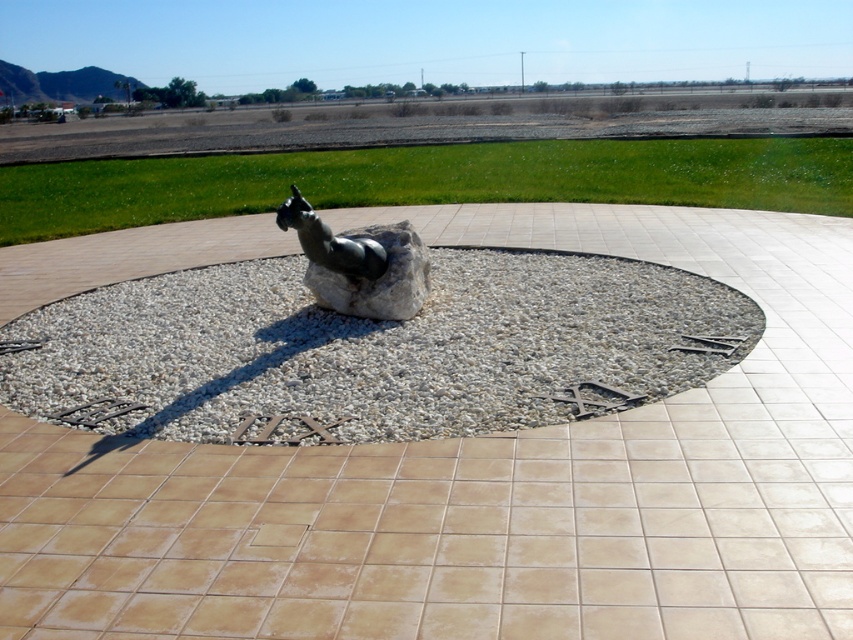
You are an artist planning to install a new sculpture in the garden. You see the white gravel at center and the polished bronze horse at center. Which object is positioned lower in the scene?

The white gravel at center is positioned below the polished bronze horse at center, so the white gravel at center is lower in the scene.

You are standing at the center of the tiled platform and want to place a new decorative item. There are two points marked on the platform where you can place it. The first point is at point (337, 614), and the second is at point (318, 298). Which point is closer to you when viewed from the center?

Point (337, 614) is in front of point (318, 298), so it is closer to you when viewed from the center of the tiled platform.